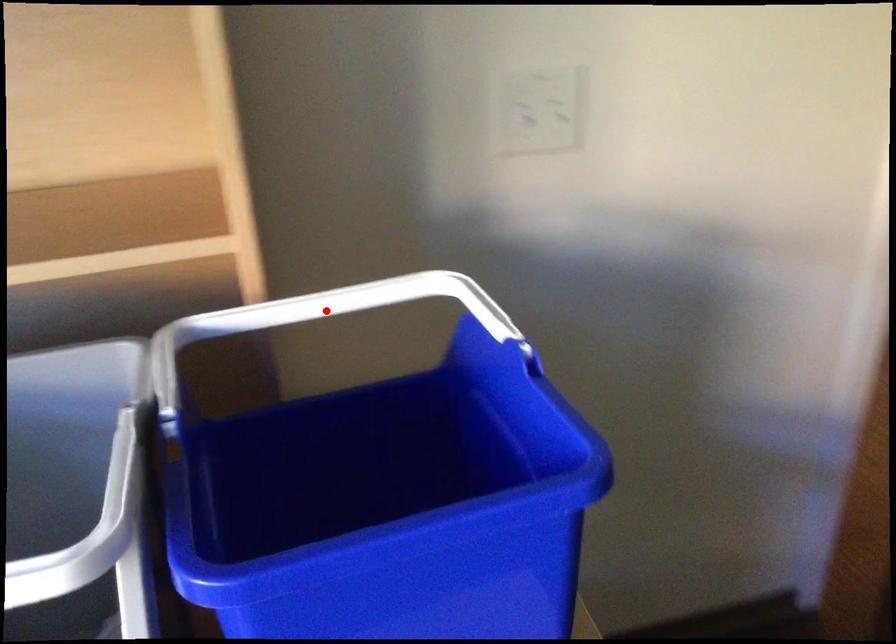
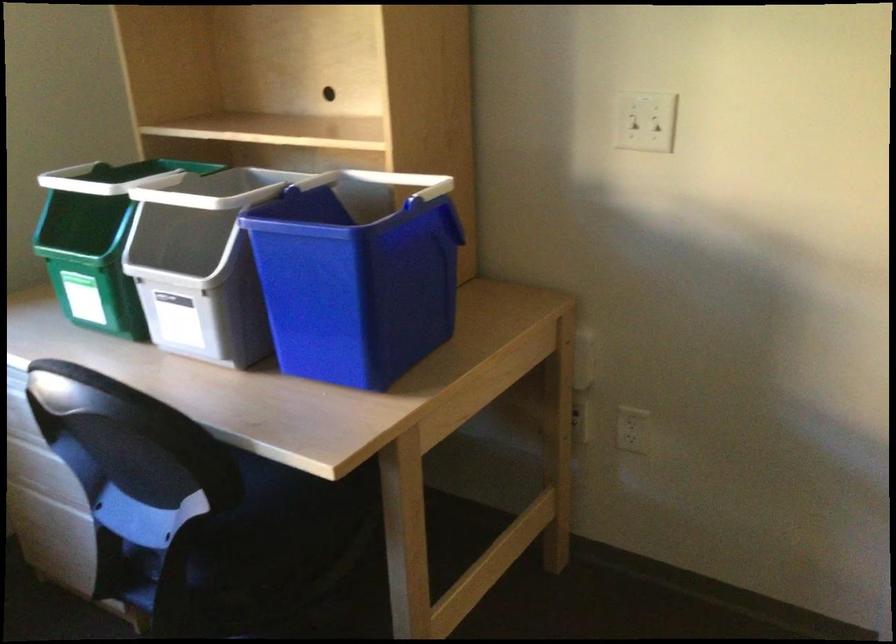
Question: I am providing you with two images of the same scene from different viewpoints. A red point is marked on the first image. At the location where the point appears in image 1, is it still visible in image 2?

Choices:
 (A) Yes
 (B) No

Answer: (A)